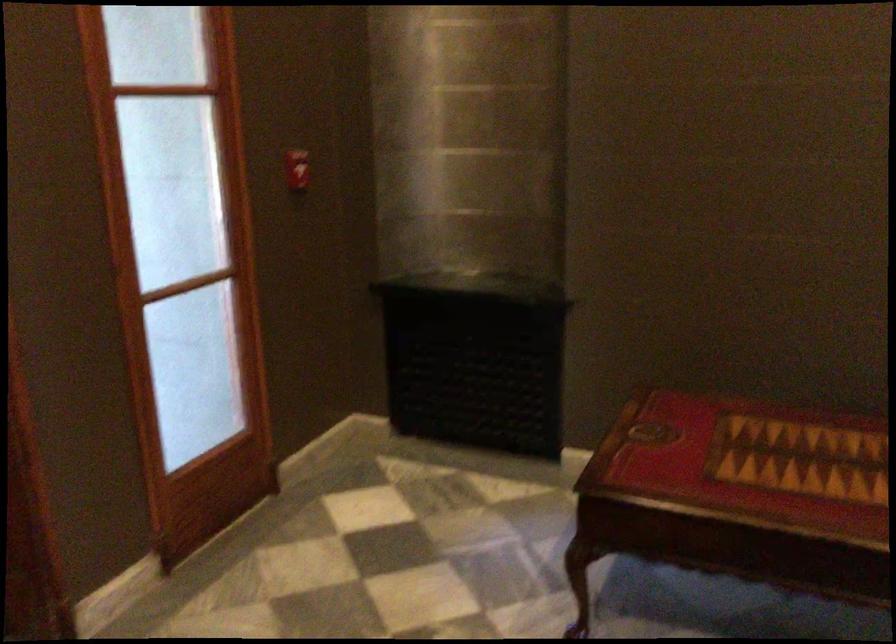
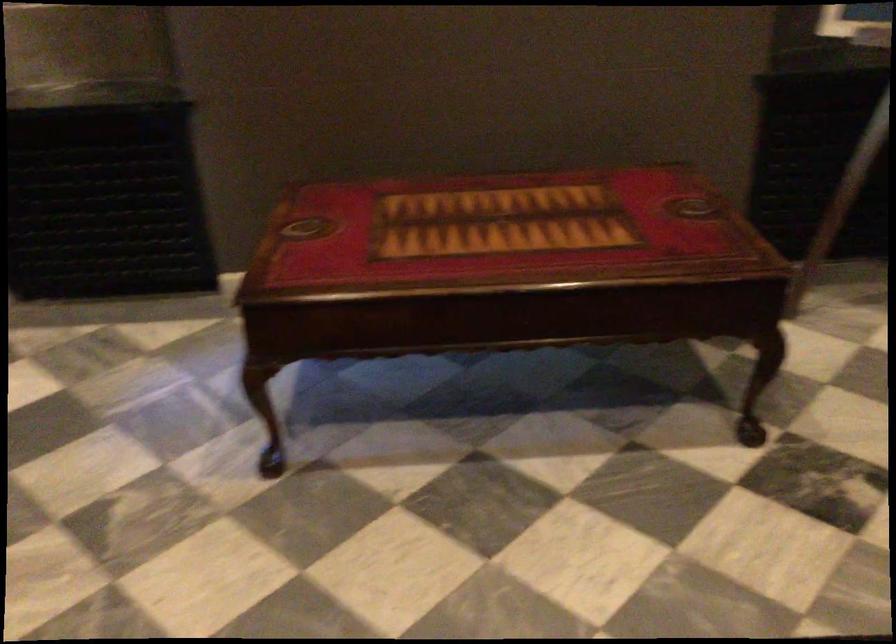
Question: The first image is from the beginning of the video and the second image is from the end. How did the camera likely rotate when shooting the video?

Choices:
 (A) Left
 (B) Right
 (C) Up
 (D) Down

Answer: (B)